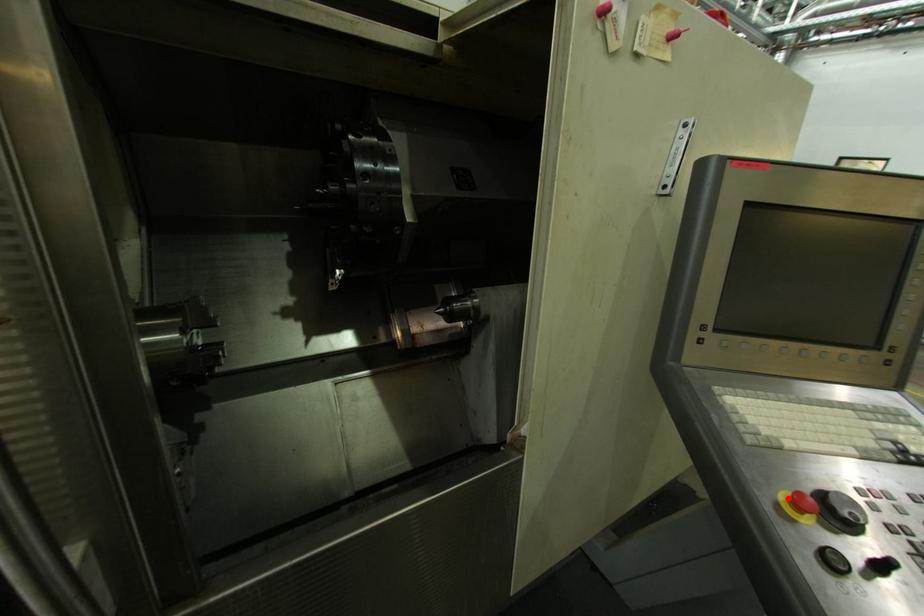
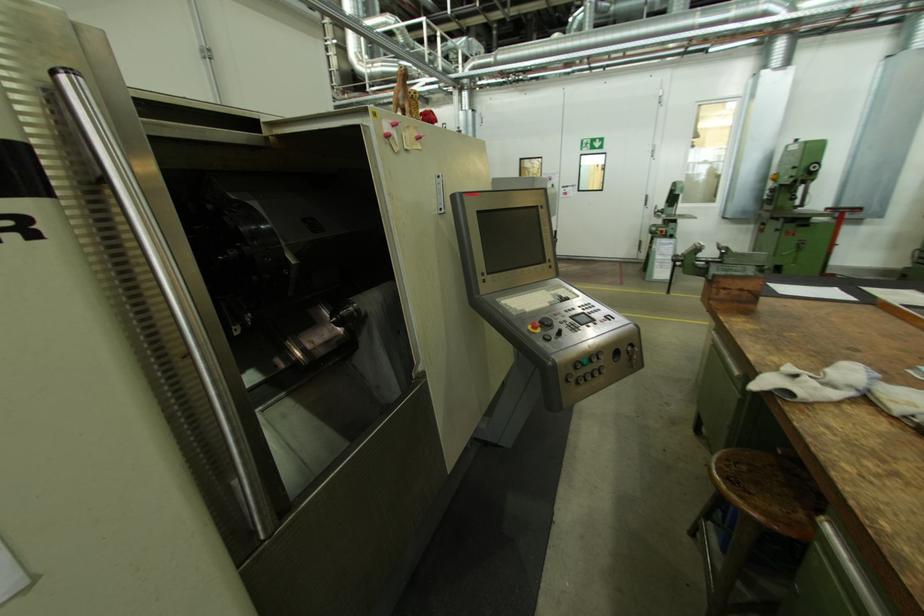
Find the pixel in the second image that matches the highlighted location in the first image.

(535, 329)